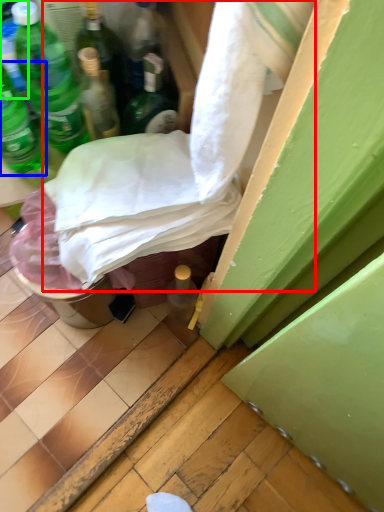
Question: Which object is positioned closest to sheet (highlighted by a red box)? Select from bottle (highlighted by a blue box) and bottle (highlighted by a green box).

Choices:
 (A) bottle
 (B) bottle

Answer: (A)